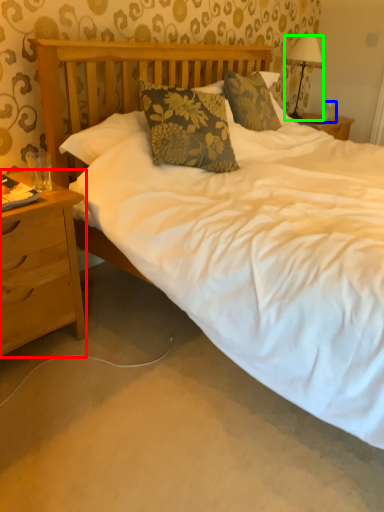
Question: Considering the real-world distances, which object is farthest from nightstand (highlighted by a red box)? coffee cup (highlighted by a blue box) or lamp (highlighted by a green box)?

Choices:
 (A) coffee cup
 (B) lamp

Answer: (A)